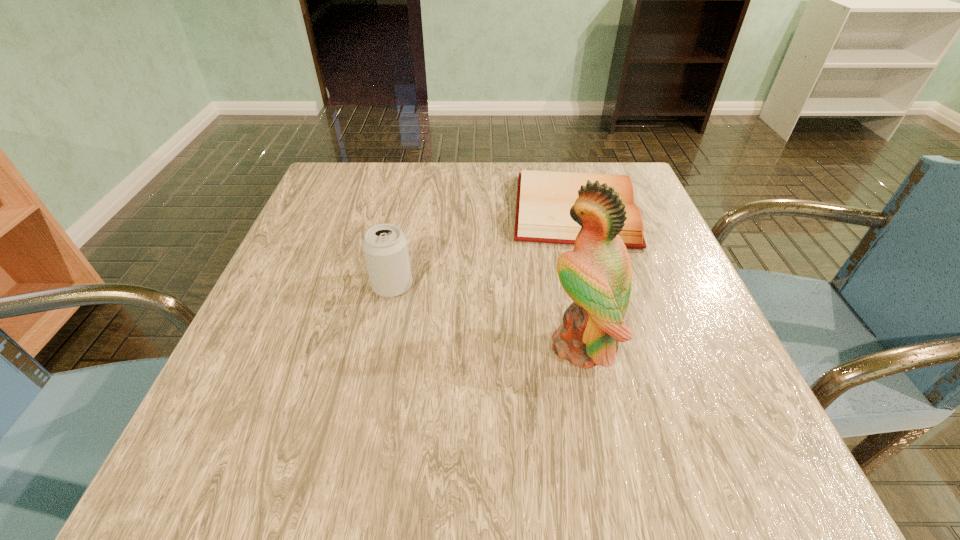
This screenshot has height=540, width=960. What are the coordinates of `free space between the can and the parrot` in the screenshot? It's located at (487, 315).

The width and height of the screenshot is (960, 540). Identify the location of vacant region between the shortest object and the second farthest object. point(484,247).

At what (x,y) coordinates should I click in order to perform the action: click on vacant space that's between the nearest object and the second shortest object. Please return your answer as a coordinate pair (x, y). This screenshot has width=960, height=540. Looking at the image, I should click on (487, 315).

Where is `vacant space that is in between the nearest object and the second shortest object`? vacant space that is in between the nearest object and the second shortest object is located at coordinates (487, 315).

The image size is (960, 540). Find the location of `free area in between the can and the nearest object`. free area in between the can and the nearest object is located at coordinates coord(487,315).

Where is `vacant area that lies between the leftmost object and the parrot`? vacant area that lies between the leftmost object and the parrot is located at coordinates (487, 315).

This screenshot has width=960, height=540. In order to click on free space between the shortest object and the second nearest object in this screenshot , I will do `click(484, 247)`.

Identify the location of the second closest object to the second shortest object. (597, 276).

Locate an element on the screen. the closest object relative to the second nearest object is located at coordinates (544, 198).

Identify the location of free spot that satisfies the following two spatial constraints: 1. on the back side of the shortest object; 2. on the right side of the second nearest object. The image size is (960, 540). (408, 210).